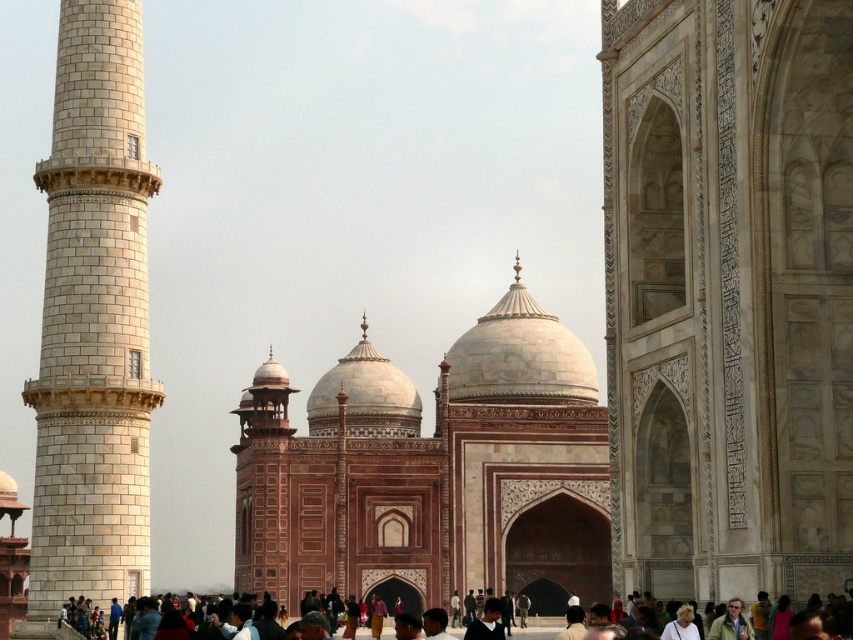
You are standing in front of the Taj Mahal and see a point marked at coordinates (728,292). Based on the scene description, can you identify which part of the Taj Mahal this point is located on?

The point at coordinates (728,292) is located on the white marble archway at the right side of the Taj Mahal.

You are standing in front of the Taj Mahal and want to take a photo that includes both the white marble archway at right and the white marble tower at left. Which object should you position closer to the front of your camera frame to ensure both are in focus?

You should position the white marble tower at left closer to the front of your camera frame because it is farther from the viewer than the white marble archway at right, ensuring both are within the depth of field.

You are standing in front of the Taj Mahal and want to take a photo of the white marble archway at right. Based on its position, which part of the frame should you aim your camera at?

The white marble archway at right is located at point (x=728, y=292), so you should aim your camera at the lower right portion of the frame to capture it properly.